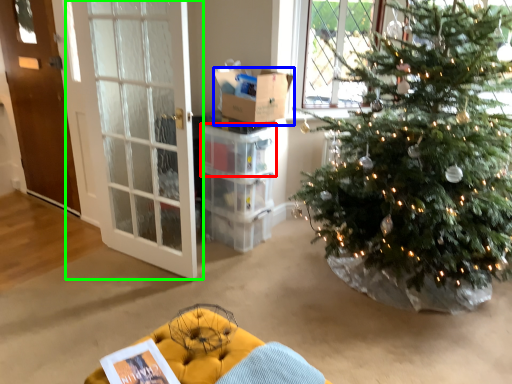
Question: Considering the real-world distances, which object is closest to crate (highlighted by a red box)? box (highlighted by a blue box) or door (highlighted by a green box).

Choices:
 (A) box
 (B) door

Answer: (A)